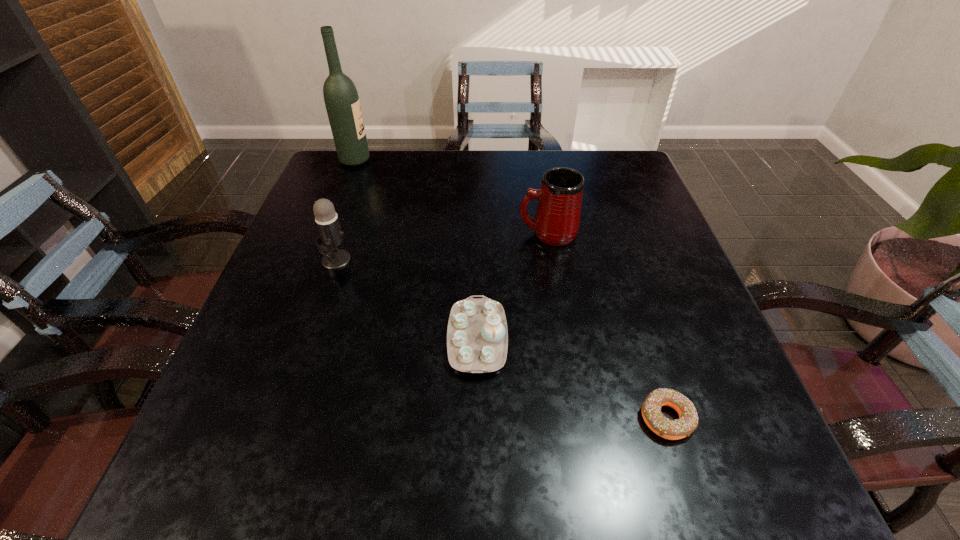
Where is `object located in the right edge section of the desktop`? object located in the right edge section of the desktop is located at coordinates (687, 422).

Find the location of a particular element. The height and width of the screenshot is (540, 960). object situated at the far left corner is located at coordinates (341, 98).

The height and width of the screenshot is (540, 960). I want to click on object that is positioned at the near right corner, so click(687, 422).

In the image, there is a desktop. At what (x,y) coordinates should I click in order to perform the action: click on free region at the far edge. Please return your answer as a coordinate pair (x, y). Looking at the image, I should click on (375, 191).

I want to click on free location at the near edge of the desktop, so click(x=447, y=461).

The width and height of the screenshot is (960, 540). In order to click on vacant space at the left edge of the desktop in this screenshot , I will do `click(351, 207)`.

Where is `free location at the right edge`? The height and width of the screenshot is (540, 960). free location at the right edge is located at coordinates (679, 369).

Locate an element on the screen. free space at the far left corner of the desktop is located at coordinates (374, 158).

The width and height of the screenshot is (960, 540). I want to click on free space at the near left corner, so click(x=179, y=489).

Identify the location of free space between the third farthest object and the wine bottle. The image size is (960, 540). (346, 210).